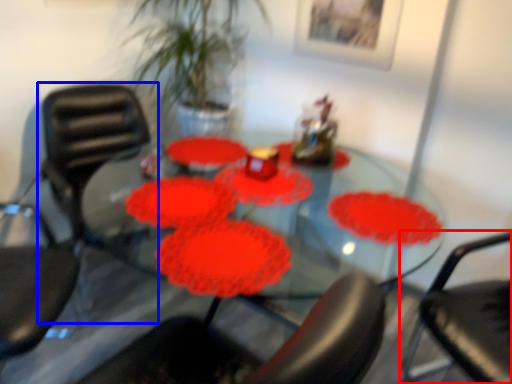
Question: Which object is closer to the camera taking this photo, chair (highlighted by a red box) or chair (highlighted by a blue box)?

Choices:
 (A) chair
 (B) chair

Answer: (A)